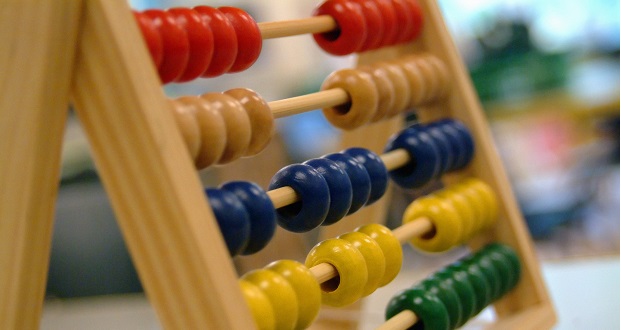
You are a GUI agent. You are given a task and a screenshot of the screen. Output one action in this format:
    pyautogui.click(x=<x>, y=<y>)
    Task: Click on the wooden dowel
    The image size is (621, 330).
    Given the screenshot: What is the action you would take?
    pyautogui.click(x=410, y=321), pyautogui.click(x=405, y=232), pyautogui.click(x=392, y=161), pyautogui.click(x=318, y=102), pyautogui.click(x=294, y=27)